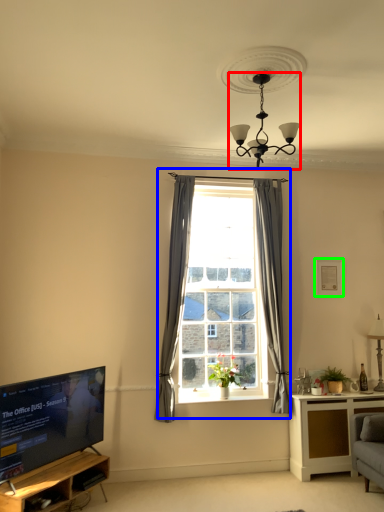
Question: Which object is positioned closest to light fixture (highlighted by a red box)? Select from window (highlighted by a blue box) and picture frame (highlighted by a green box).

Choices:
 (A) window
 (B) picture frame

Answer: (A)